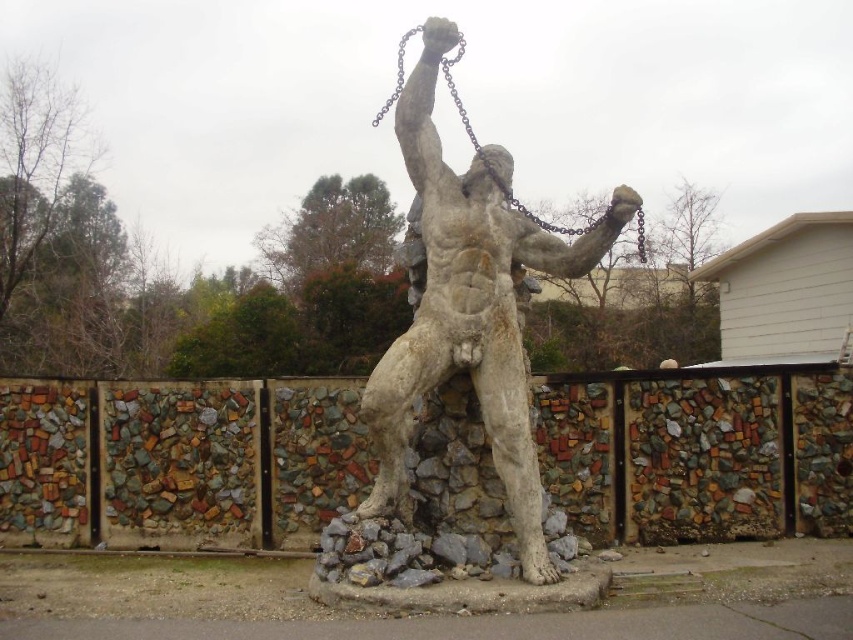
Question: Is white stone statue at center positioned behind dark gray metallic chain at upper center?

Choices:
 (A) yes
 (B) no

Answer: (B)

Question: Can you confirm if stained glass mosaic fence at center is positioned to the left of white stone statue at center?

Choices:
 (A) no
 (B) yes

Answer: (B)

Question: Which of the following is the closest to the observer?

Choices:
 (A) (426, 177)
 (B) (747, 436)
 (C) (461, 45)

Answer: (C)

Question: Which of the following is the farthest from the observer?

Choices:
 (A) (793, 467)
 (B) (396, 70)

Answer: (B)

Question: Among these points, which one is farthest from the camera?

Choices:
 (A) (407, 33)
 (B) (146, 385)
 (C) (450, 83)

Answer: (A)

Question: Is stained glass mosaic fence at center further to camera compared to dark gray metallic chain at upper center?

Choices:
 (A) no
 (B) yes

Answer: (B)